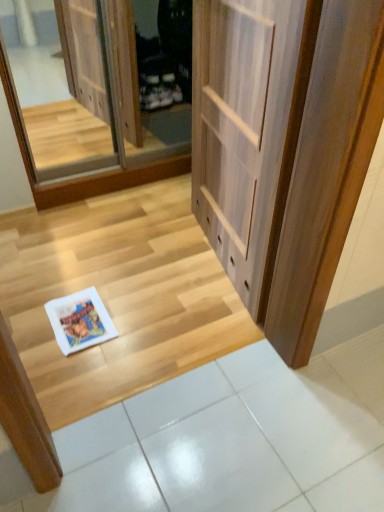
Locate an element on the screen. The width and height of the screenshot is (384, 512). free spot above white glossy tile at lower center (from a real-world perspective) is located at coordinates (253, 429).